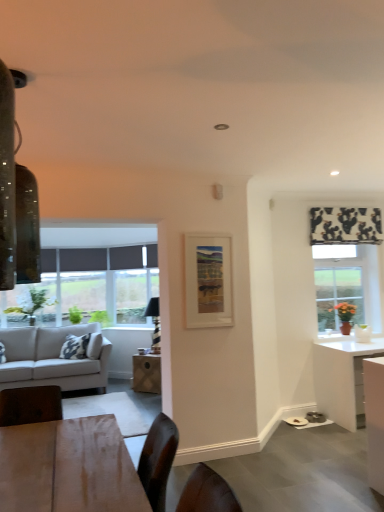
Question: In terms of height, does black and white fabric at upper right look taller or shorter compared to wooden table at center?

Choices:
 (A) tall
 (B) short

Answer: (B)

Question: Considering the positions of black and white fabric at upper right and wooden table at center in the image, is black and white fabric at upper right wider or thinner than wooden table at center?

Choices:
 (A) wide
 (B) thin

Answer: (B)

Question: Estimate the real-world distances between objects in this image. Which object is farther from the matte wooden picture frame at center?

Choices:
 (A) green matte plant at right
 (B) white glossy desk at right
 (C) black and white fabric at upper right
 (D) wooden table at center
 (E) white glossy cabinet at lower right

Answer: (A)

Question: Based on their relative distances, which object is farther from the matte wooden picture frame at center?

Choices:
 (A) light gray fabric couch at left
 (B) green matte plant at right
 (C) white glossy desk at right
 (D) wooden table at center
 (E) white glossy cabinet at lower right

Answer: (B)